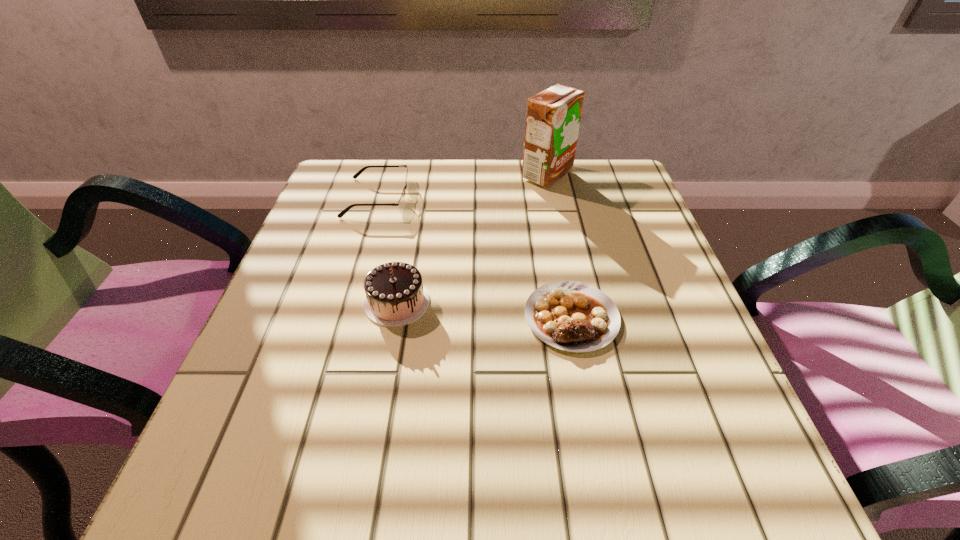
Find the location of a particular element. Image resolution: width=960 pixels, height=540 pixels. carton at the far edge is located at coordinates (553, 116).

You are a GUI agent. You are given a task and a screenshot of the screen. Output one action in this format:
    pyautogui.click(x=<x>, y=<y>)
    Task: Click on the spectacles at the far edge
    The width and height of the screenshot is (960, 540).
    Given the screenshot: What is the action you would take?
    pyautogui.click(x=401, y=203)

The image size is (960, 540). In order to click on object that is at the left edge in this screenshot , I will do `click(401, 203)`.

Where is `carton located at the right edge`? The height and width of the screenshot is (540, 960). carton located at the right edge is located at coordinates (553, 116).

Identify the location of steak positioned at the right edge. (572, 316).

Identify the location of object situated at the far left corner. (401, 203).

At what (x,y) coordinates should I click in order to perform the action: click on object present at the far right corner. Please return your answer as a coordinate pair (x, y). Looking at the image, I should click on (553, 116).

Image resolution: width=960 pixels, height=540 pixels. I want to click on vacant space at the far edge of the desktop, so click(475, 161).

Image resolution: width=960 pixels, height=540 pixels. I want to click on vacant region at the left edge of the desktop, so click(303, 271).

Find the location of a particular element. Image resolution: width=960 pixels, height=540 pixels. vacant space at the right edge of the desktop is located at coordinates (644, 251).